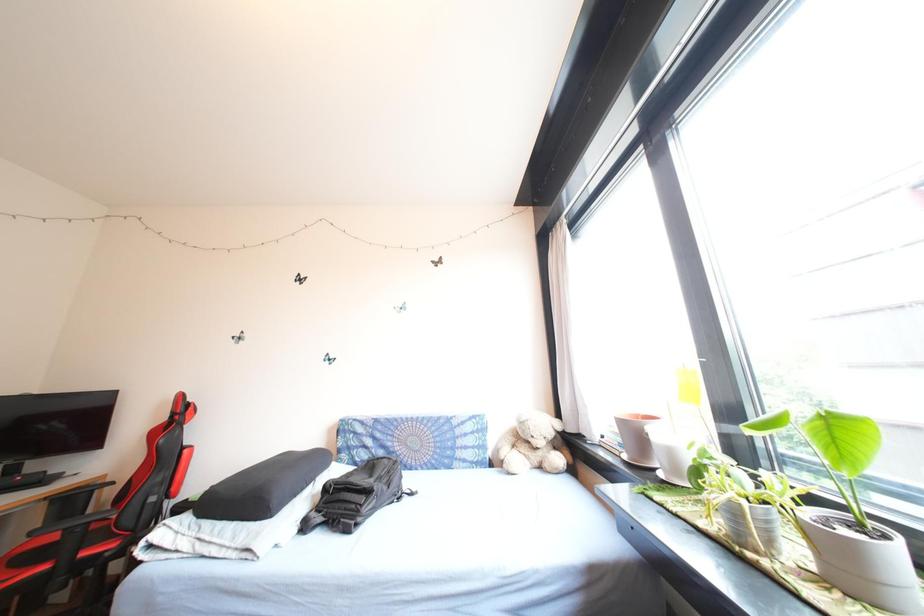
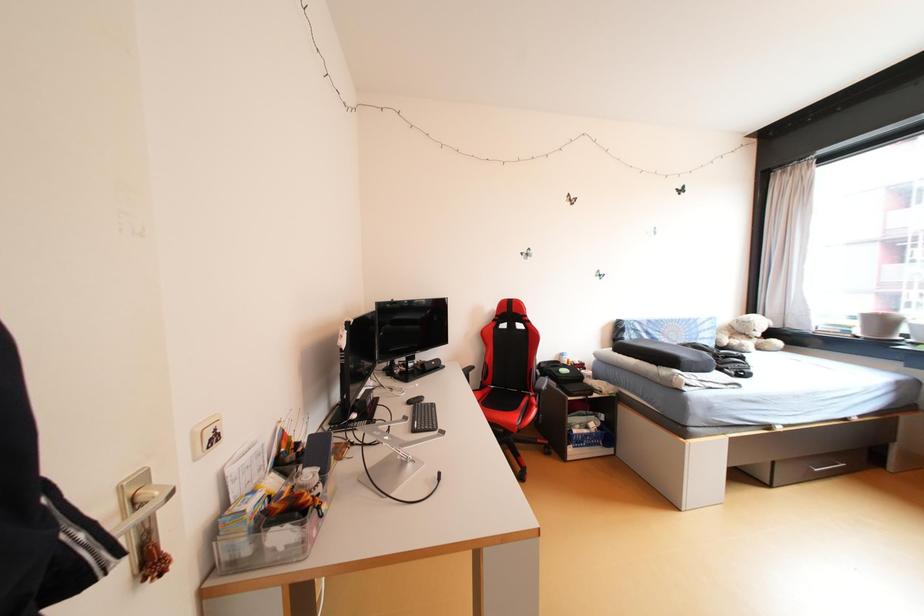
Question: In a continuous first-person perspective shot, in which direction is the camera moving?

Choices:
 (A) Left
 (B) Right
 (C) Forward
 (D) Backward

Answer: (A)